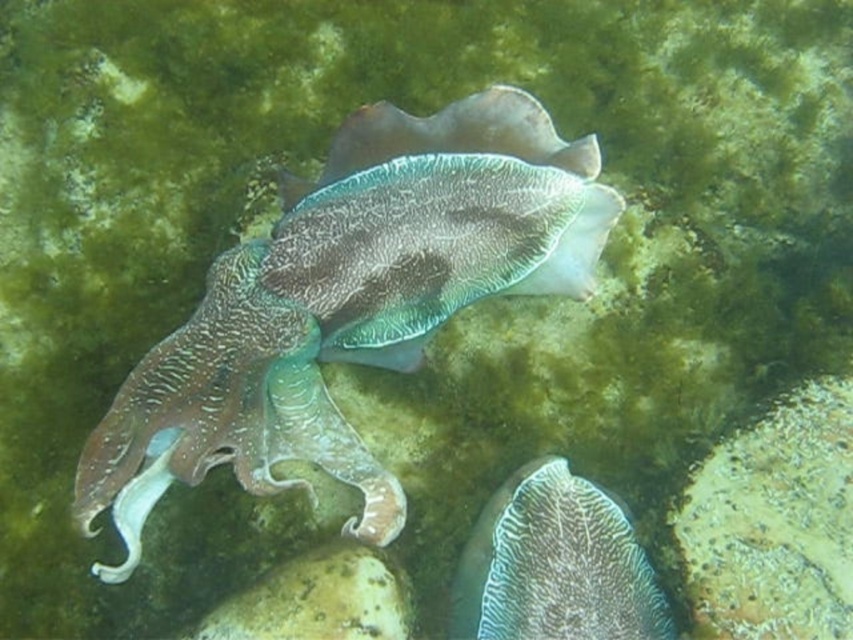
You are a marine biologist observing an underwater scene. You notice the textured brown squid at center and the textured white coral at center. Which object is closer to the seabed?

The textured white coral at center is closer to the seabed because the textured brown squid at center is positioned over it.

Consider the image. You are a marine biologist examining an underwater scene. You notice the textured brown squid at center and the textured white coral at center. Based on their positions, which object is more likely to be wider?

The textured brown squid at center might be wider than textured white coral at center according to the description.